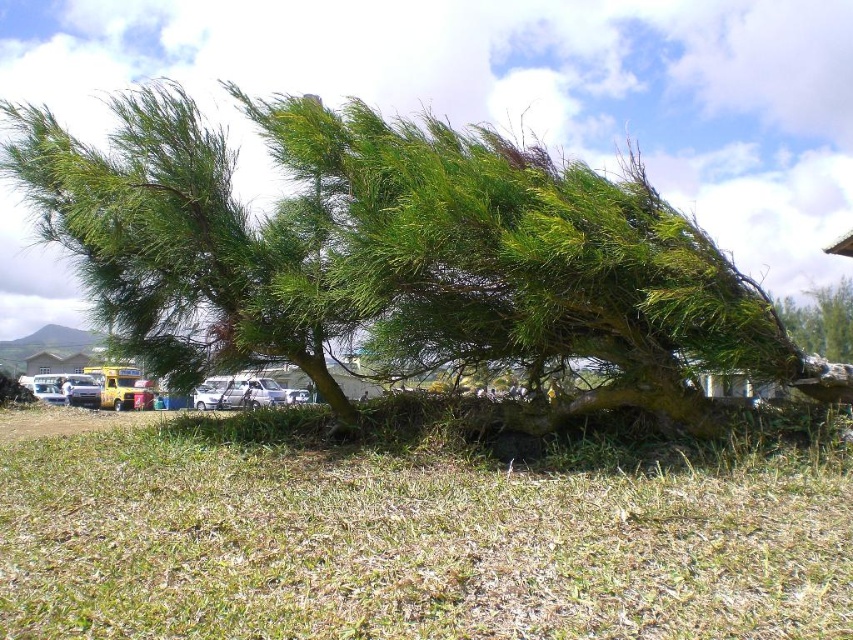
Question: Among these points, which one is nearest to the camera?

Choices:
 (A) (253, 380)
 (B) (805, 492)
 (C) (271, 353)
 (D) (844, 280)

Answer: (B)

Question: Can you confirm if green dry grass at lower center is positioned to the right of green leafy tree at upper right?

Choices:
 (A) no
 (B) yes

Answer: (A)

Question: Among these objects, which one is farthest from the camera?

Choices:
 (A) green leafy tree at upper right
 (B) green leafy tree at center
 (C) white matte car at center
 (D) green dry grass at lower center

Answer: (A)

Question: Is green dry grass at lower center to the left of green leafy tree at upper right from the viewer's perspective?

Choices:
 (A) no
 (B) yes

Answer: (B)

Question: Which point appears farthest from the camera in this image?

Choices:
 (A) (180, 156)
 (B) (193, 454)

Answer: (A)

Question: Is green leafy tree at center positioned behind green dry grass at lower center?

Choices:
 (A) no
 (B) yes

Answer: (B)